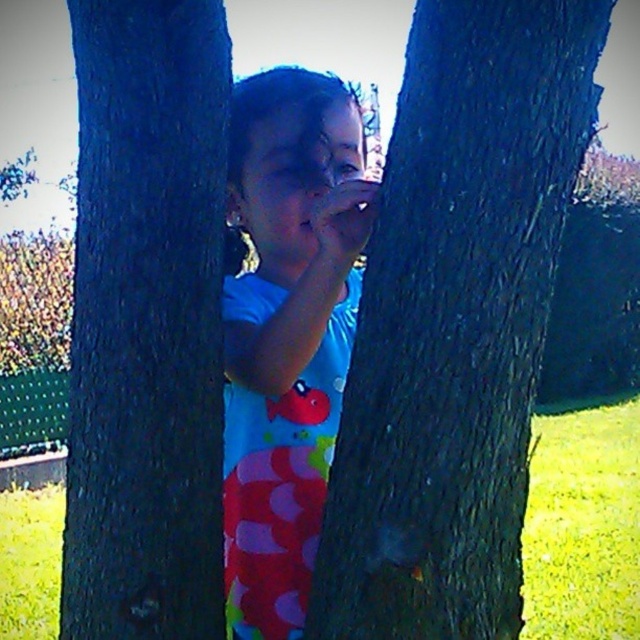
From the picture: Can you confirm if smooth bark tree trunk at center is positioned above dark brown rough tree trunk at center?

Actually, smooth bark tree trunk at center is below dark brown rough tree trunk at center.

This screenshot has width=640, height=640. Describe the element at coordinates (456, 323) in the screenshot. I see `smooth bark tree trunk at center` at that location.

Does point (404, 531) lie in front of point (193, 164)?

That is True.

Locate an element on the screen. This screenshot has width=640, height=640. smooth bark tree trunk at center is located at coordinates (456, 323).

From the picture: Does dark brown rough tree trunk at center appear under blue fabric at center?

Correct, dark brown rough tree trunk at center is located below blue fabric at center.

Is dark brown rough tree trunk at center to the right of blue fabric at center from the viewer's perspective?

No, dark brown rough tree trunk at center is not to the right of blue fabric at center.

Is point (170, 285) more distant than point (241, 140)?

No, it is in front of (241, 140).

The width and height of the screenshot is (640, 640). What are the coordinates of `dark brown rough tree trunk at center` in the screenshot? It's located at [x=147, y=323].

Does smooth bark tree trunk at center have a greater width compared to blue fabric at center?

Yes.

Between smooth bark tree trunk at center and blue fabric at center, which one appears on the right side from the viewer's perspective?

Positioned to the right is smooth bark tree trunk at center.

Image resolution: width=640 pixels, height=640 pixels. Describe the element at coordinates (456, 323) in the screenshot. I see `smooth bark tree trunk at center` at that location.

Where is `smooth bark tree trunk at center`? smooth bark tree trunk at center is located at coordinates (456, 323).